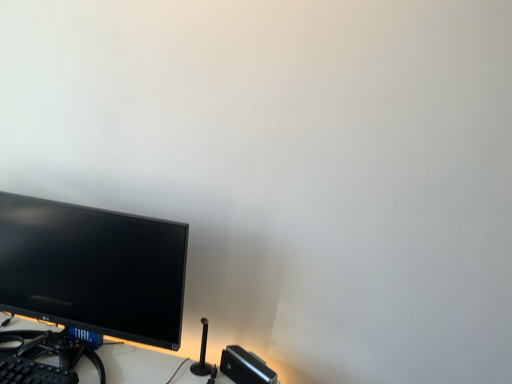
Question: Based on their positions, is black plastic keyboard at lower left located to the left or right of matte black monitor at left?

Choices:
 (A) left
 (B) right

Answer: (A)

Question: In terms of width, does black plastic keyboard at lower left look wider or thinner when compared to matte black monitor at left?

Choices:
 (A) wide
 (B) thin

Answer: (A)

Question: Would you say black plastic keyboard at lower left is inside or outside matte black monitor at left?

Choices:
 (A) inside
 (B) outside

Answer: (B)

Question: In terms of width, does matte black monitor at left look wider or thinner when compared to black plastic keyboard at lower left?

Choices:
 (A) thin
 (B) wide

Answer: (A)

Question: Would you say matte black monitor at left is to the left or to the right of black plastic keyboard at lower left in the picture?

Choices:
 (A) left
 (B) right

Answer: (B)

Question: Considering their positions, is matte black monitor at left located in front of or behind black plastic keyboard at lower left?

Choices:
 (A) behind
 (B) front

Answer: (A)

Question: Is matte black monitor at left spatially inside black plastic keyboard at lower left, or outside of it?

Choices:
 (A) inside
 (B) outside

Answer: (B)